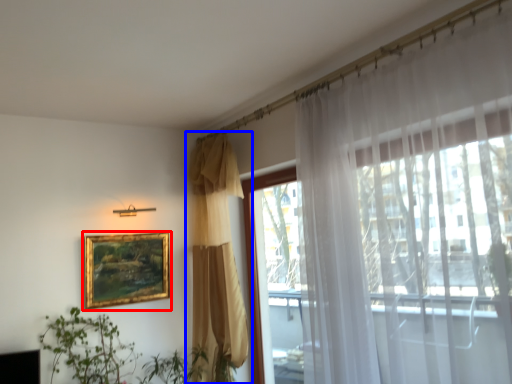
Question: Which object is closer to the camera taking this photo, picture frame (highlighted by a red box) or curtain (highlighted by a blue box)?

Choices:
 (A) picture frame
 (B) curtain

Answer: (B)